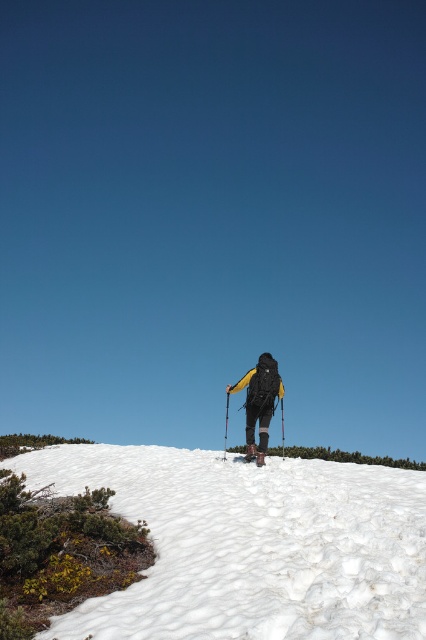
You are a drone operator trying to capture the hiker on the snow slope. The drone is currently at the position of the white fluffy snow at center. The hiker is moving towards the top of the slope. To follow the hiker, should you move the drone in the direction of higher y or lower y coordinate based on the 2D coordinate system?

The white fluffy snow at center is located at point (250,545) in the 2D coordinate system. Since the hiker is moving towards the top of the slope, which would correspond to a higher y coordinate, you should move the drone in the direction of higher y to follow the hiker.

You are planning to carry both the matte black backpack at center and the black matte ski pole at center during your hike. Considering their sizes, which one might be more challenging to maneuver through narrow mountain paths?

The matte black backpack at center is larger in size than the black matte ski pole at center, so it might be more challenging to maneuver through narrow mountain paths.

You are a hiker trying to determine if your ski pole can be fully buried in the snow. Based on the scene, can the black matte ski pole at center be completely submerged in the white fluffy snow at center?

The white fluffy snow at center has a lesser height compared to black matte ski pole at center. Therefore, the ski pole cannot be fully submerged in the snow as the snow depth is insufficient to cover its entire length.